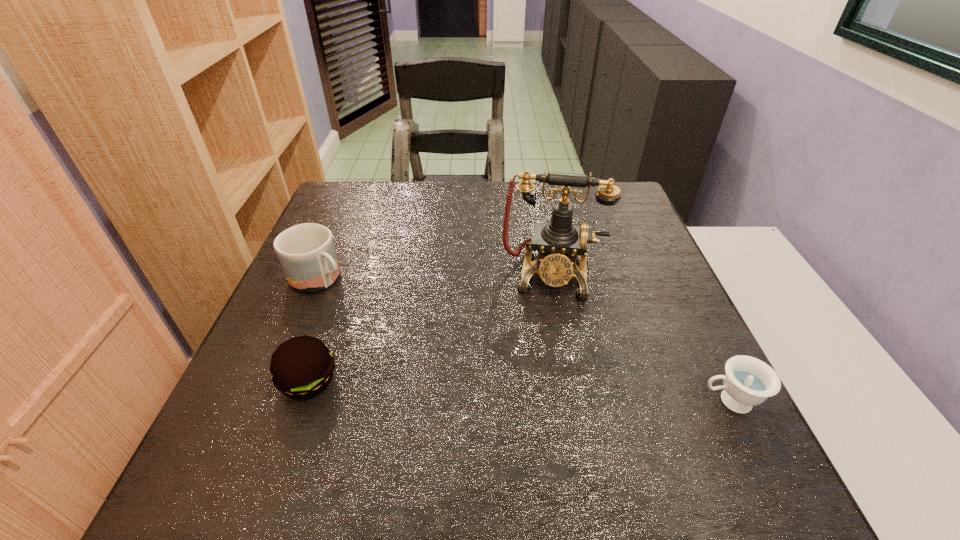
Identify the location of patty. This screenshot has height=540, width=960. (302, 367).

Where is `the rightmost object`? the rightmost object is located at coordinates (748, 381).

The width and height of the screenshot is (960, 540). I want to click on teacup, so click(x=748, y=381).

At what (x,y) coordinates should I click in order to perform the action: click on the third object from left to right. Please return your answer as a coordinate pair (x, y). Looking at the image, I should click on (559, 242).

Locate an element on the screen. telephone is located at coordinates (559, 242).

Find the location of a particular element. The height and width of the screenshot is (540, 960). mug is located at coordinates (306, 252).

Image resolution: width=960 pixels, height=540 pixels. I want to click on vacant space located 0.060m on the right of the patty, so click(x=372, y=381).

Where is `free space located on the side of the teacup with the handle`? free space located on the side of the teacup with the handle is located at coordinates (631, 401).

Where is `vacant point located on the side of the teacup with the handle`? vacant point located on the side of the teacup with the handle is located at coordinates click(x=659, y=401).

You are a GUI agent. You are given a task and a screenshot of the screen. Output one action in this format:
    pyautogui.click(x=<x>, y=<y>)
    Task: Click on the free point located 0.280m on the side of the teacup with the handle
    
    Given the screenshot: What is the action you would take?
    pyautogui.click(x=542, y=401)